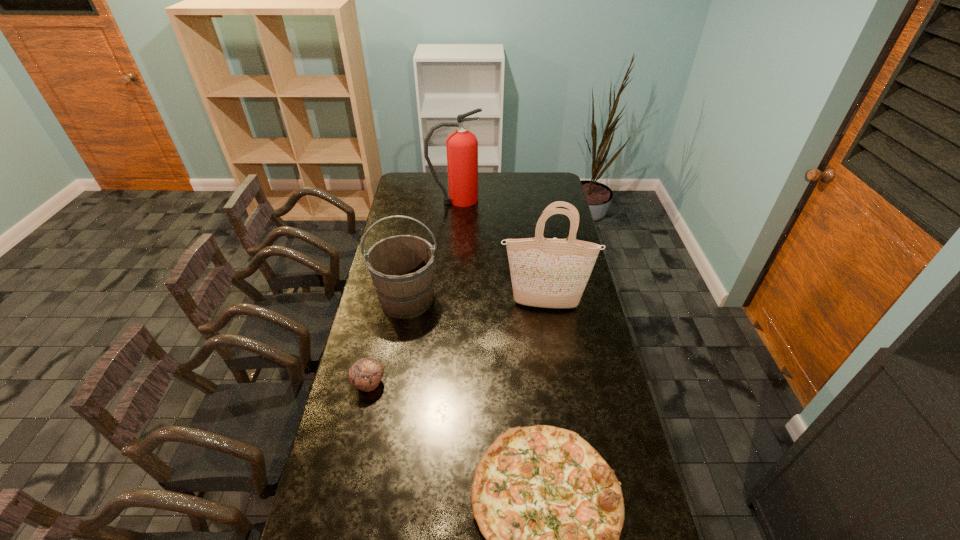
Image resolution: width=960 pixels, height=540 pixels. I want to click on bucket that is at the left edge, so click(401, 267).

Find the location of a particular element. muffin at the left edge is located at coordinates (365, 374).

Find the location of a particular element. object located at the right edge is located at coordinates (550, 273).

Find the location of a particular element. The width and height of the screenshot is (960, 540). vacant space at the far edge of the desktop is located at coordinates (436, 194).

Locate an element on the screen. vacant space at the left edge of the desktop is located at coordinates (408, 215).

Identify the location of vacant space at the right edge. The image size is (960, 540). (601, 384).

Image resolution: width=960 pixels, height=540 pixels. In order to click on free space at the far right corner in this screenshot , I will do `click(537, 174)`.

Where is `free spot between the muffin and the bucket`? The height and width of the screenshot is (540, 960). free spot between the muffin and the bucket is located at coordinates (388, 341).

The image size is (960, 540). Find the location of `empty space between the muffin and the third tallest object`. empty space between the muffin and the third tallest object is located at coordinates [x=388, y=341].

The image size is (960, 540). In order to click on blank region between the fire extinguisher and the shopping bag in this screenshot , I will do `click(500, 252)`.